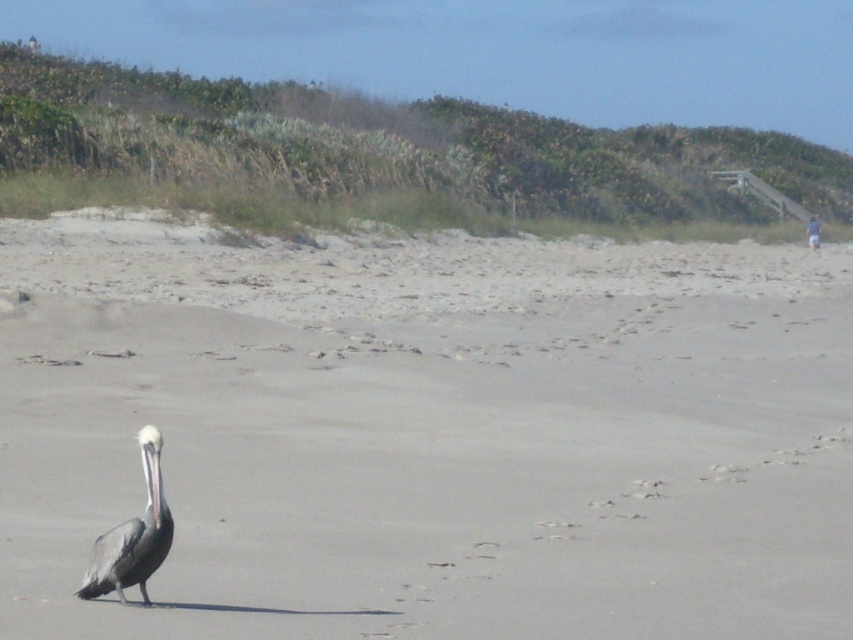
Question: Does gray sand at center appear on the left side of gray matte pelican at lower left?

Choices:
 (A) no
 (B) yes

Answer: (A)

Question: Observing the image, what is the correct spatial positioning of gray sand at center in reference to gray matte pelican at lower left?

Choices:
 (A) above
 (B) below

Answer: (A)

Question: Considering the relative positions of gray sand at center and gray matte pelican at lower left in the image provided, where is gray sand at center located with respect to gray matte pelican at lower left?

Choices:
 (A) left
 (B) right

Answer: (B)

Question: Which point is closer to the camera?

Choices:
 (A) (148, 552)
 (B) (473, 442)

Answer: (A)